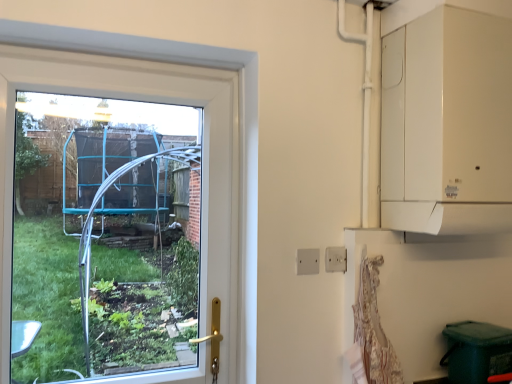
Question: Can you confirm if white plastic electric outlet at center is bigger than transparent glass window at left?

Choices:
 (A) no
 (B) yes

Answer: (A)

Question: Does white plastic electric outlet at center touch transparent glass window at left?

Choices:
 (A) no
 (B) yes

Answer: (A)

Question: Can you confirm if white plastic electric outlet at center is smaller than transparent glass window at left?

Choices:
 (A) yes
 (B) no

Answer: (A)

Question: Does white plastic electric outlet at center come in front of transparent glass window at left?

Choices:
 (A) no
 (B) yes

Answer: (A)

Question: Is there a large distance between white plastic electric outlet at center and transparent glass window at left?

Choices:
 (A) yes
 (B) no

Answer: (B)

Question: Can you confirm if white plastic electric outlet at center is thinner than transparent glass window at left?

Choices:
 (A) no
 (B) yes

Answer: (B)

Question: From the image's perspective, is transparent glass window at left located beneath white plastic electric outlet at center?

Choices:
 (A) yes
 (B) no

Answer: (B)

Question: Does transparent glass window at left have a greater width compared to white plastic electric outlet at center?

Choices:
 (A) yes
 (B) no

Answer: (A)

Question: Is transparent glass window at left looking in the opposite direction of white plastic electric outlet at center?

Choices:
 (A) yes
 (B) no

Answer: (B)

Question: Does transparent glass window at left lie behind white plastic electric outlet at center?

Choices:
 (A) yes
 (B) no

Answer: (B)

Question: Can you confirm if transparent glass window at left is shorter than white plastic electric outlet at center?

Choices:
 (A) no
 (B) yes

Answer: (A)

Question: Is transparent glass window at left facing towards white plastic electric outlet at center?

Choices:
 (A) no
 (B) yes

Answer: (A)

Question: Considering their positions, is white plastic electric outlet at center located in front of or behind transparent glass window at left?

Choices:
 (A) behind
 (B) front

Answer: (A)